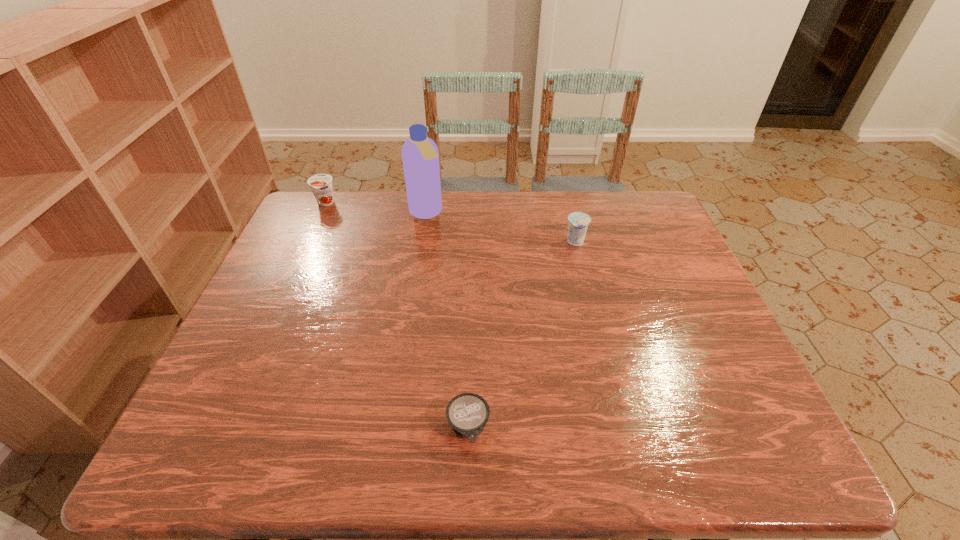
This screenshot has width=960, height=540. In order to click on vacant space in between the third object from left to right and the second farthest yogurt in this screenshot , I will do `click(522, 335)`.

The width and height of the screenshot is (960, 540). Identify the location of vacant area that lies between the shampoo and the second farthest yogurt. point(501,228).

The image size is (960, 540). I want to click on vacant area between the leftmost yogurt and the rightmost object, so click(450, 223).

The height and width of the screenshot is (540, 960). In order to click on vacant area that lies between the third object from right to left and the leftmost yogurt in this screenshot , I will do `click(375, 208)`.

Where is `vacant area between the tallest object and the second farthest yogurt`? This screenshot has width=960, height=540. vacant area between the tallest object and the second farthest yogurt is located at coordinates (501, 228).

At what (x,y) coordinates should I click in order to perform the action: click on vacant area between the second nearest object and the leftmost yogurt. Please return your answer as a coordinate pair (x, y). This screenshot has height=540, width=960. Looking at the image, I should click on (450, 223).

Find the location of `blank region between the leftmost yogurt and the rightmost object`. blank region between the leftmost yogurt and the rightmost object is located at coordinates (450, 223).

This screenshot has width=960, height=540. In order to click on vacant area that lies between the farthest yogurt and the shampoo in this screenshot , I will do `click(375, 208)`.

Where is `free space between the leftmost yogurt and the rightmost object`? The height and width of the screenshot is (540, 960). free space between the leftmost yogurt and the rightmost object is located at coordinates (450, 223).

Where is `free space that is in between the second nearest yogurt and the shortest object`? The image size is (960, 540). free space that is in between the second nearest yogurt and the shortest object is located at coordinates (522, 335).